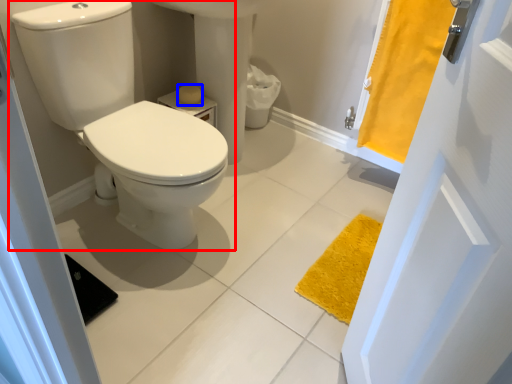
Question: Which object appears farthest to the camera in this image, toilet (highlighted by a red box) or toilet paper (highlighted by a blue box)?

Choices:
 (A) toilet
 (B) toilet paper

Answer: (B)